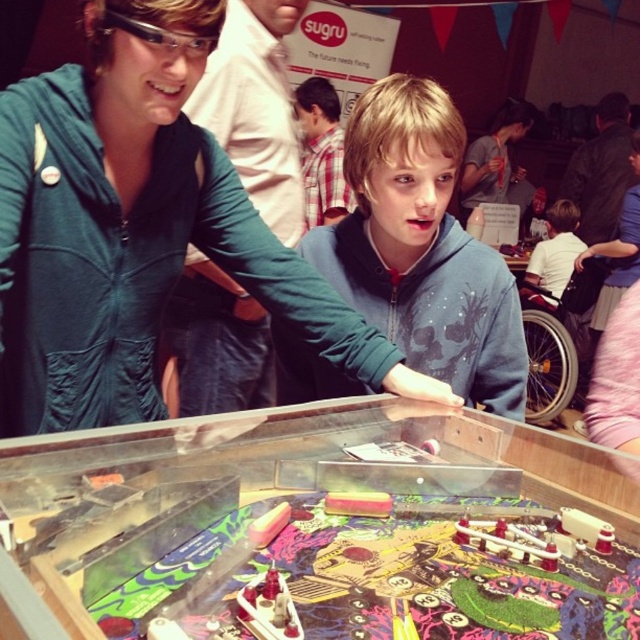
Question: From the image, what is the correct spatial relationship of blue fleece hoodie at center in relation to green matte jacket at upper left?

Choices:
 (A) left
 (B) right

Answer: (B)

Question: Based on their relative distances, which object is nearer to the green matte jacket at upper left?

Choices:
 (A) blue fleece hoodie at center
 (B) matte green hoodie at center
 (C) black leather jacket at upper right

Answer: (A)

Question: Which object is closer to the camera taking this photo?

Choices:
 (A) blue fleece hoodie at center
 (B) green matte jacket at upper left

Answer: (A)

Question: Which point is closer to the camera taking this photo?

Choices:
 (A) 595,204
 (B) 216,54

Answer: (B)

Question: Does matte green hoodie at center come in front of black leather jacket at upper right?

Choices:
 (A) yes
 (B) no

Answer: (A)

Question: Does plaid shirt at center have a lesser width compared to matte black hoodie at center?

Choices:
 (A) yes
 (B) no

Answer: (A)